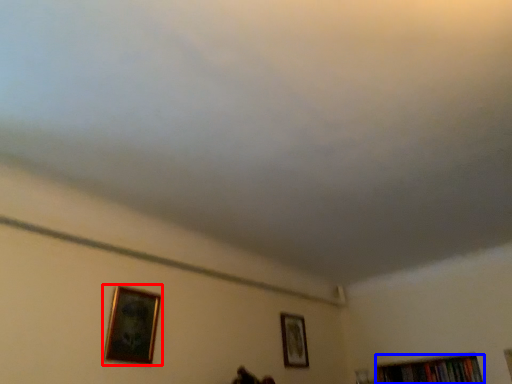
Question: Which point is further to the camera, picture frame (highlighted by a red box) or book (highlighted by a blue box)?

Choices:
 (A) picture frame
 (B) book

Answer: (B)